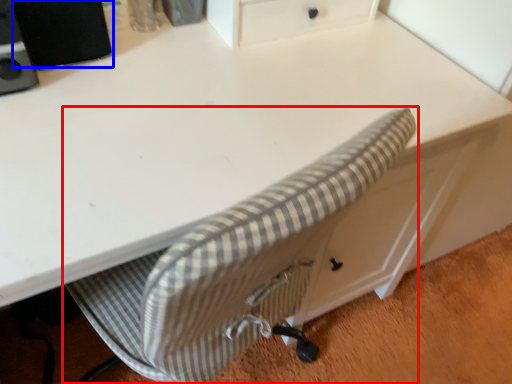
Question: Which object appears farthest to the camera in this image, chair (highlighted by a red box) or speaker (highlighted by a blue box)?

Choices:
 (A) chair
 (B) speaker

Answer: (A)